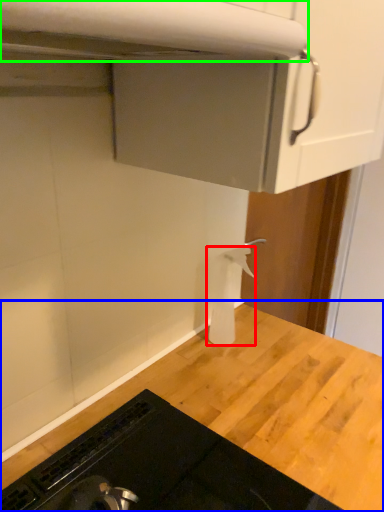
Question: Considering the real-world distances, which object is farthest from toilet paper (highlighted by a red box)? countertop (highlighted by a blue box) or exhaust hood (highlighted by a green box)?

Choices:
 (A) countertop
 (B) exhaust hood

Answer: (B)